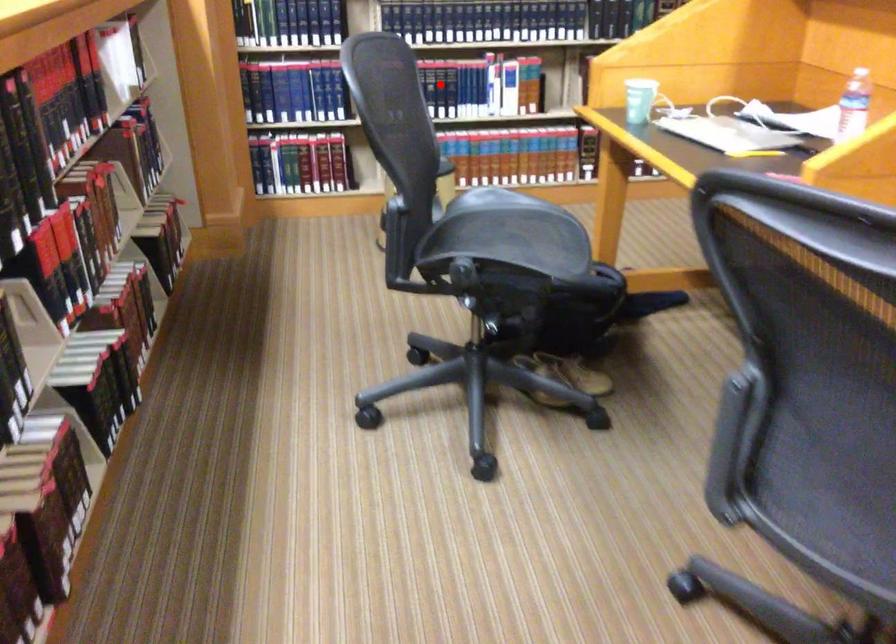
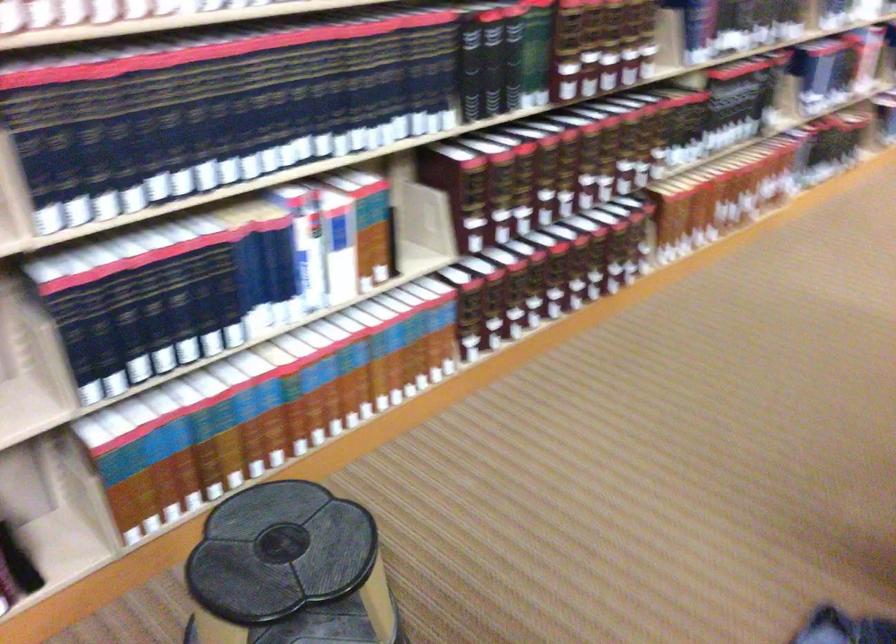
Question: I am providing you with two images of the same scene from different viewpoints. Image1 has a red point marked. In image2, the corresponding 3D location appears at what relative position? Reply with the corresponding letter.

Choices:
 (A) Closer
 (B) Farther

Answer: (A)